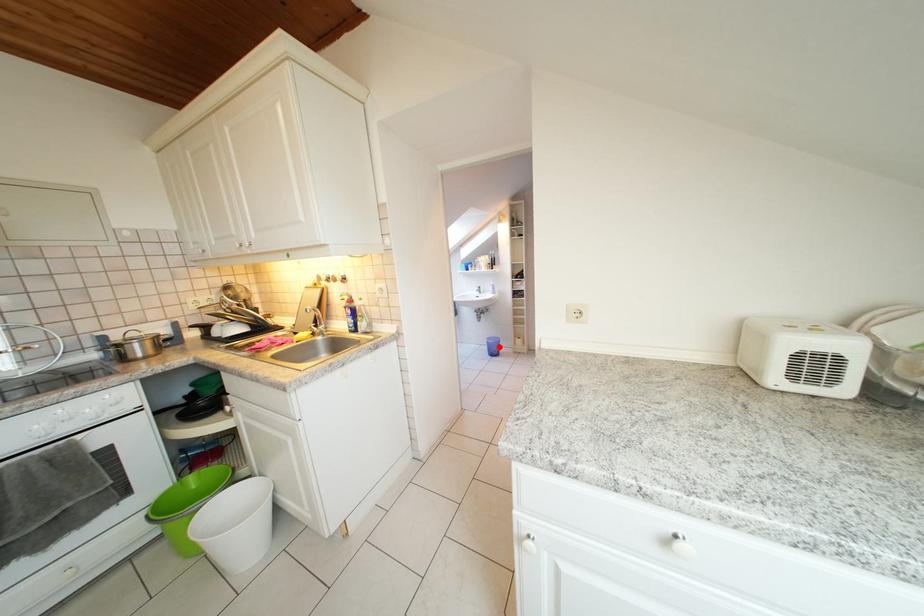
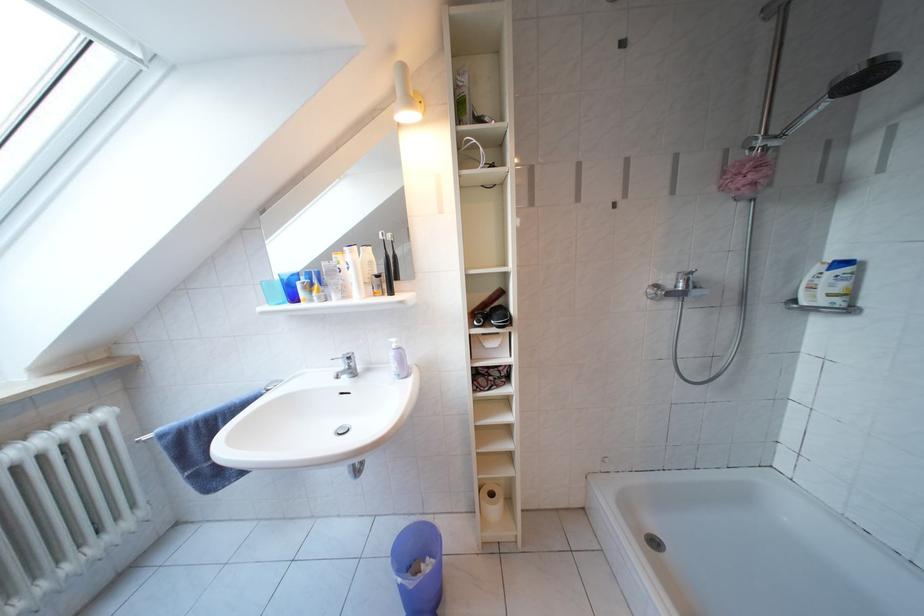
Find the pixel in the second image that matches the highlighted location in the first image.

(419, 589)